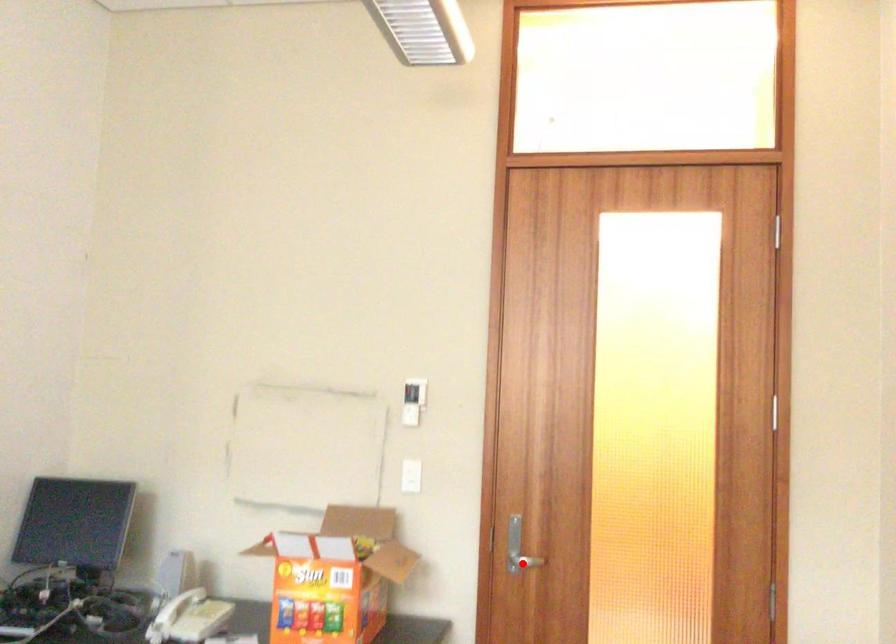
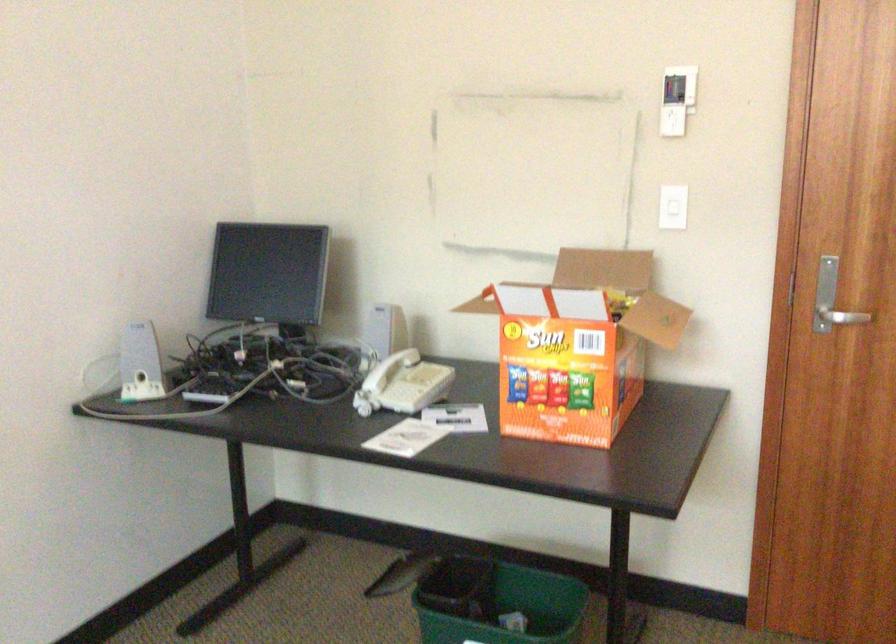
Question: I am providing you with two images of the same scene from different viewpoints. A red point is shown in image1. For the corresponding object point in image2, is it positioned nearer or farther from the camera?

Choices:
 (A) Nearer
 (B) Farther

Answer: (A)